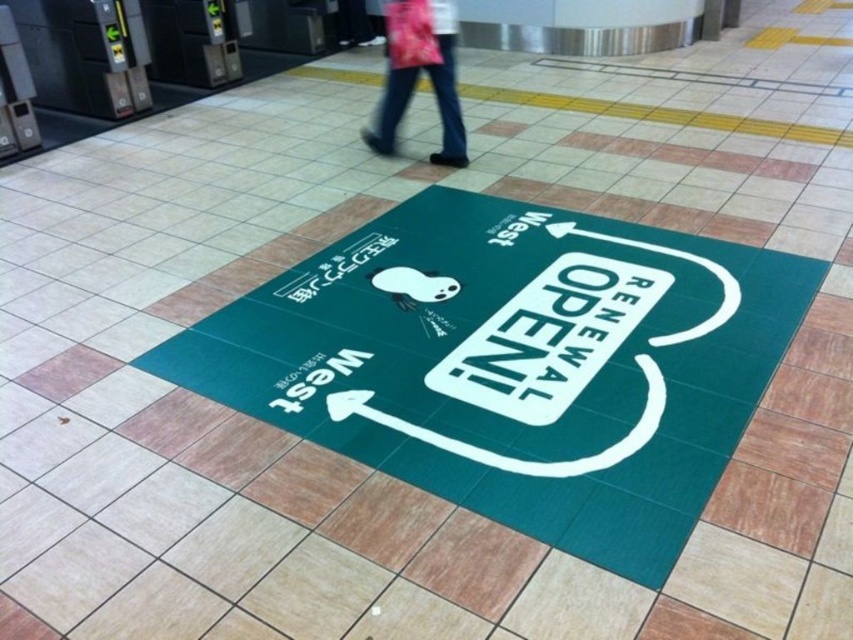
You are standing in the subway station and see the green rubber mat at center and the pink fabric pants at upper center. Which object is taller?

The green rubber mat at center is taller than the pink fabric pants at upper center.

You are standing at the subway station and see two points marked on the tiled floor. The first point is at coordinate point [613,352] and the second is at point [456,157]. Which point is closer to you if you are facing the green sign with the panda graphic?

Point [613,352] is in front of point [456,157], so it is closer to you when facing the green sign with the panda graphic.

You are standing on the tiled floor of the subway station and see the green rubber mat at center and the pink fabric pants at upper center. Which object is positioned to the right of the other?

The green rubber mat at center is to the right of the pink fabric pants at upper center.